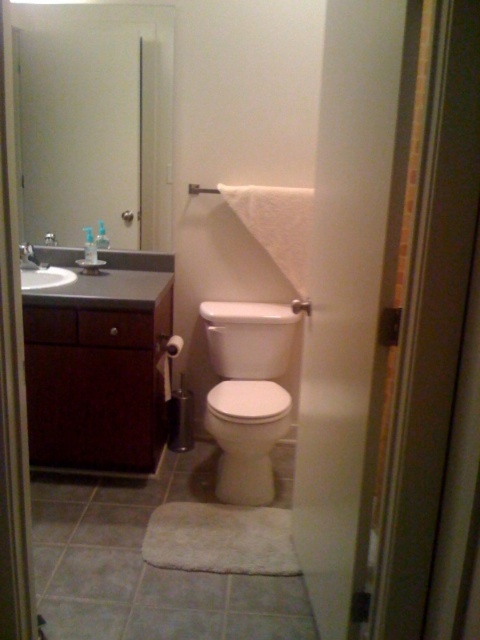
Question: From the image, what is the correct spatial relationship of dark wood vanity at left in relation to white glossy toilet at center?

Choices:
 (A) below
 (B) above

Answer: (B)

Question: Does white glossy toilet at center appear under white glossy sink at upper left?

Choices:
 (A) yes
 (B) no

Answer: (A)

Question: Considering the real-world distances, which object is farthest from the white glossy toilet at center?

Choices:
 (A) dark wood vanity at left
 (B) white glossy sink at upper left
 (C) matte white shower at center

Answer: (B)

Question: Which point appears closest to the camera in this image?

Choices:
 (A) (240, 340)
 (B) (38, 278)
 (C) (296, 307)
 (D) (158, 332)

Answer: (C)

Question: Is dark wood vanity at left thinner than matte white shower at center?

Choices:
 (A) yes
 (B) no

Answer: (B)

Question: Which of these objects is positioned farthest from the dark wood vanity at left?

Choices:
 (A) white glossy toilet at center
 (B) matte white shower at center
 (C) white glossy sink at upper left

Answer: (B)